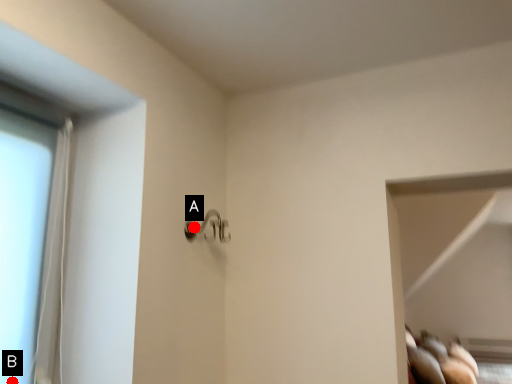
Question: Two points are circled on the image, labeled by A and B beside each circle. Which point is farther to the camera?

Choices:
 (A) A is further
 (B) B is further

Answer: (A)